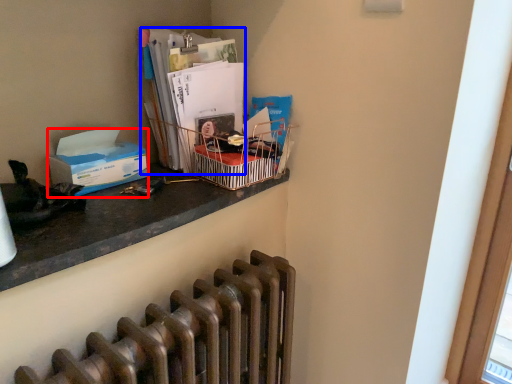
Question: Which point is closer to the camera, box (highlighted by a red box) or magazine (highlighted by a blue box)?

Choices:
 (A) box
 (B) magazine

Answer: (A)